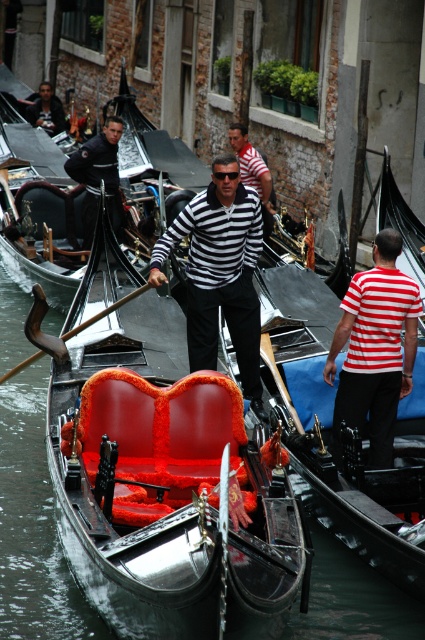
Question: Which point is farther from the camera taking this photo?

Choices:
 (A) (85, 218)
 (B) (251, 605)
 (C) (241, 220)

Answer: (A)

Question: Does striped fabric shirt at center have a smaller size compared to dark blue leather jacket at upper left?

Choices:
 (A) no
 (B) yes

Answer: (B)

Question: Can you confirm if red striped shirt at right is wider than dark blue leather jacket at upper left?

Choices:
 (A) yes
 (B) no

Answer: (B)

Question: Where is striped fabric shirt at center located in relation to dark blue leather jacket at upper left in the image?

Choices:
 (A) right
 (B) left

Answer: (A)

Question: Which of the following is the farthest from the observer?

Choices:
 (A) (384, 298)
 (B) (105, 182)

Answer: (B)

Question: Which of these objects is positioned farthest from the red striped shirt at right?

Choices:
 (A) striped fabric shirt at center
 (B) velvet red seat at center
 (C) dark blue leather jacket at upper left

Answer: (C)